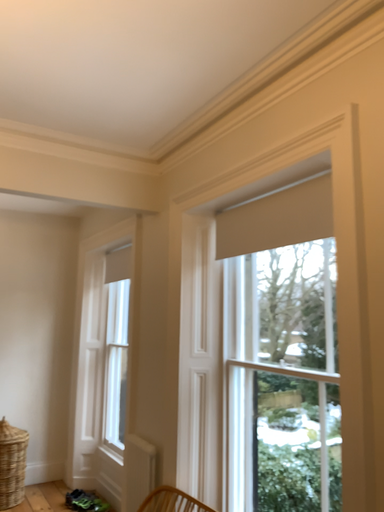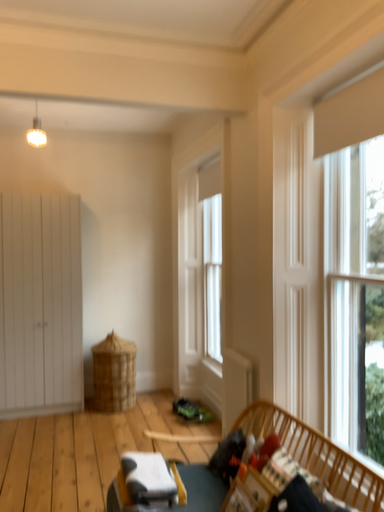
Question: How did the camera likely rotate when shooting the video?

Choices:
 (A) rotated upward
 (B) rotated downward

Answer: (B)